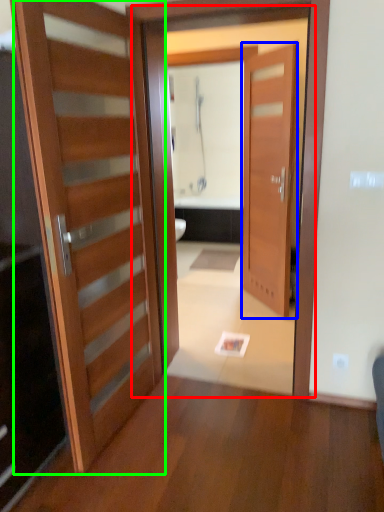
Question: Which object is the closest to the screen door (highlighted by a red box)? Choose among these: door (highlighted by a blue box) or door (highlighted by a green box).

Choices:
 (A) door
 (B) door

Answer: (B)